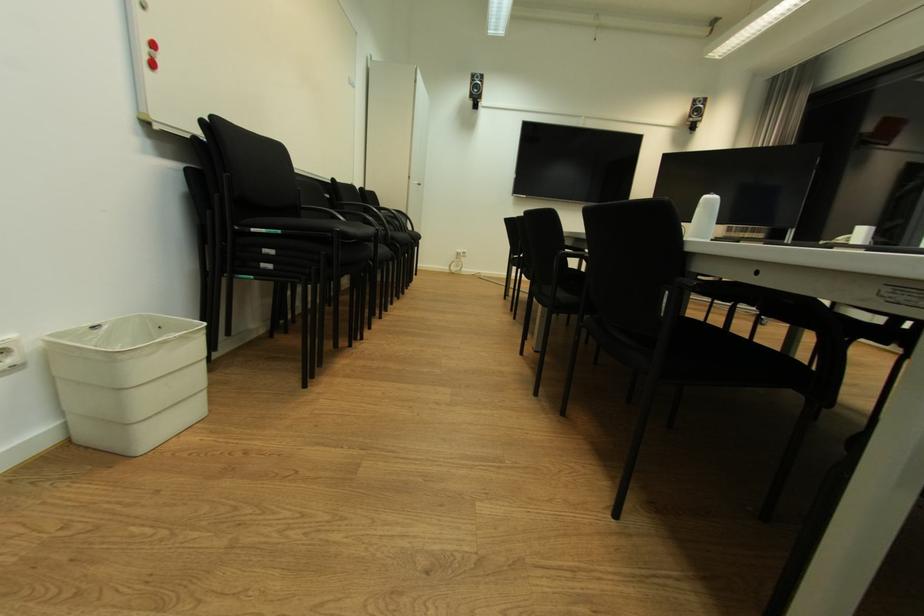
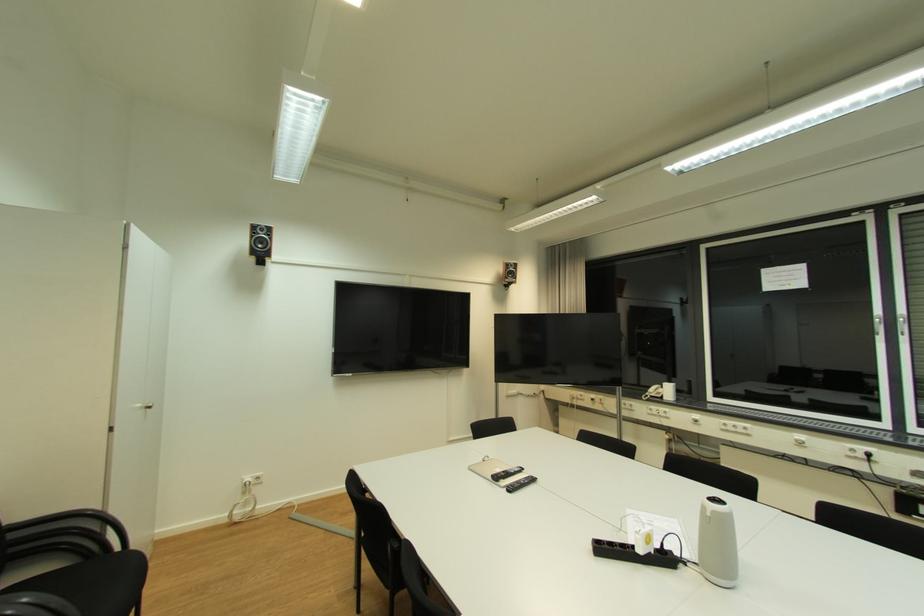
Locate, in the second image, the point that corresponds to (465,252) in the first image.

(253, 480)